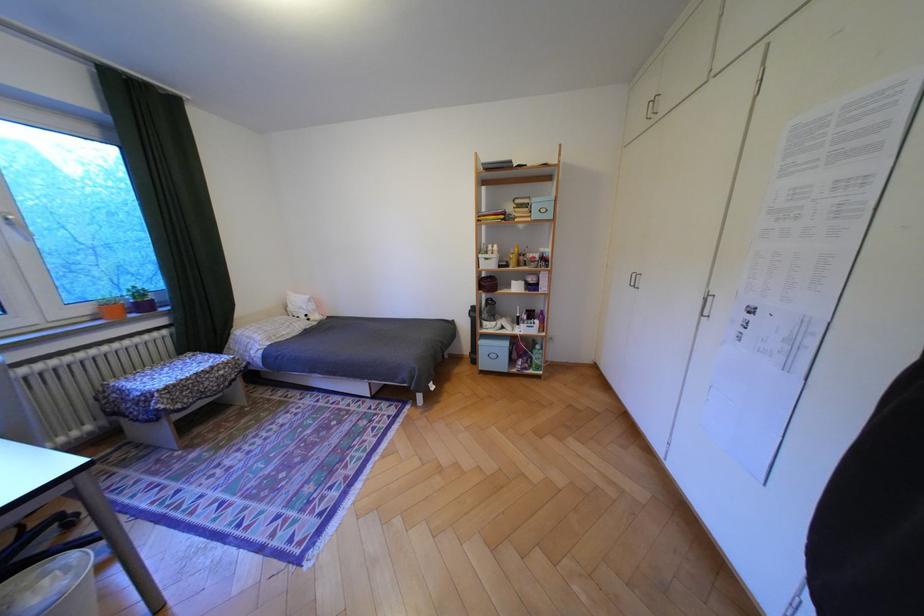
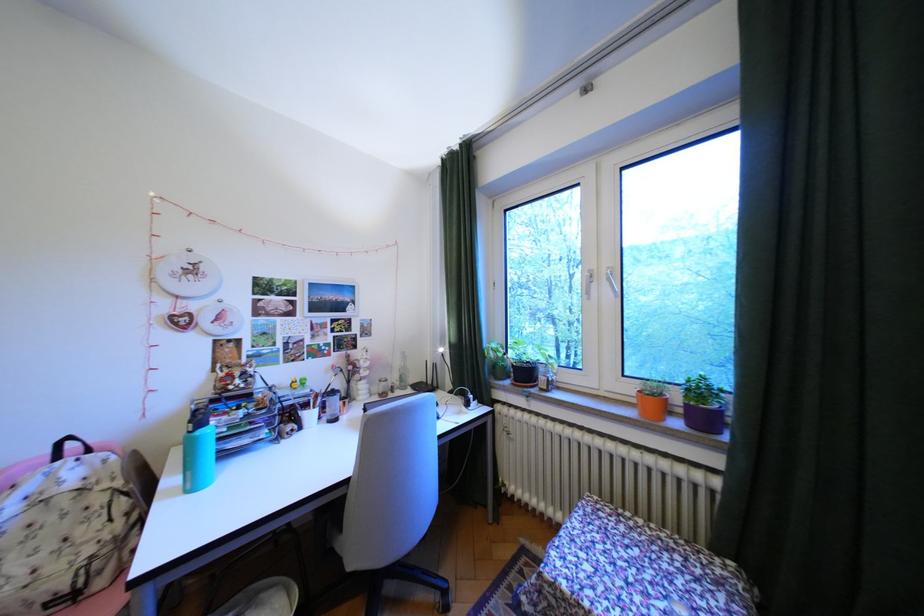
The point at (99,310) is marked in the first image. Where is the corresponding point in the second image?

(641, 390)